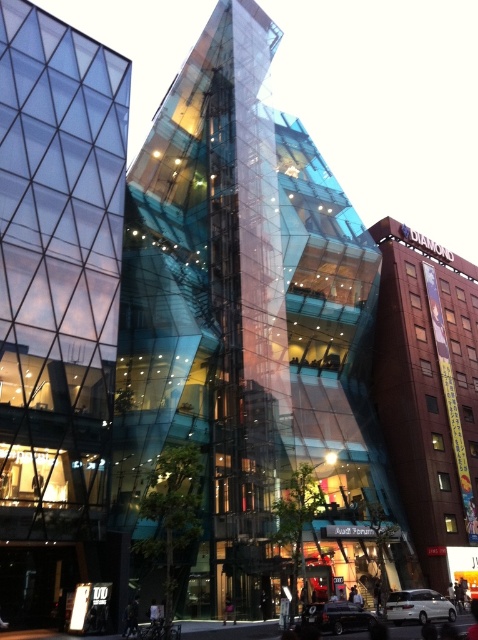
Consider the image. You are a delivery person trying to park a van that is 2 meters wide. You see the white glossy car at lower center and the shiny black car at lower center. Can you determine if there is enough space between them to park your van?

The white glossy car at lower center might be wider than the shiny black car at lower center, so the space between them may not be sufficient for the van which is 2 meters wide. It is recommended to measure the exact distance before attempting to park.

You are a parking attendant who needs to determine which car is shorter between the white glossy car at lower center and the shiny black car at lower center. Based on the scene description, which car should you identify as the shorter one?

The white glossy car at lower center has a lesser height compared to the shiny black car at lower center, so the white glossy car at lower center is the shorter one.